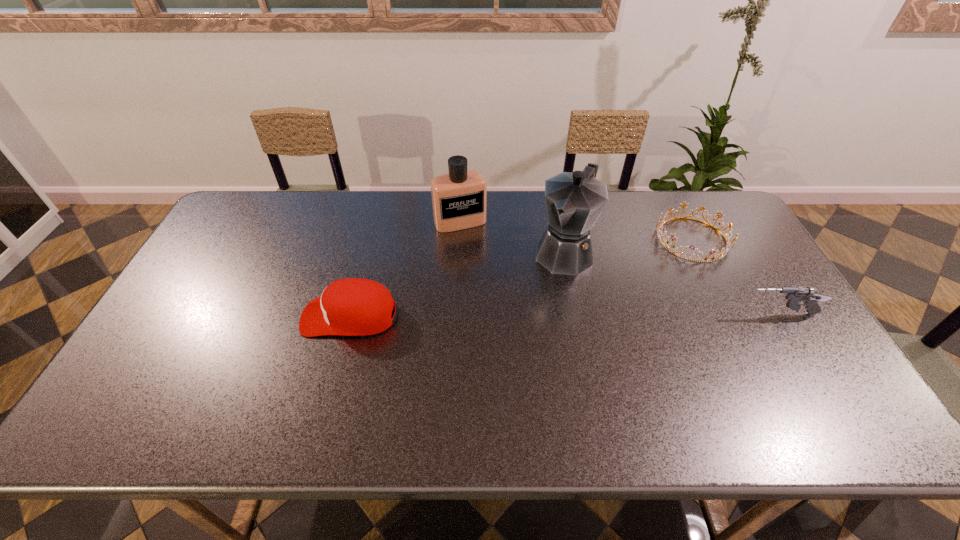
Locate an element on the screen. This screenshot has height=540, width=960. blank space at the left edge of the desktop is located at coordinates (228, 247).

In the image, there is a desktop. Where is `vacant space at the right edge`? vacant space at the right edge is located at coordinates (750, 278).

The height and width of the screenshot is (540, 960). In order to click on free space at the far right corner in this screenshot , I will do `click(707, 192)`.

Identify the location of free area in between the shortest object and the leftmost object. (521, 278).

Locate an element on the screen. This screenshot has width=960, height=540. vacant area that lies between the third object from left to right and the shortest object is located at coordinates (628, 245).

You are a GUI agent. You are given a task and a screenshot of the screen. Output one action in this format:
    pyautogui.click(x=<x>, y=<y>)
    Task: Click on the vacant point located between the tiara and the leftmost object
    This screenshot has height=540, width=960.
    Given the screenshot: What is the action you would take?
    [521, 278]

What are the coordinates of `vacant area between the leftmost object and the coffeepot` in the screenshot? It's located at (457, 284).

Image resolution: width=960 pixels, height=540 pixels. Find the location of `vacant point located between the leftmost object and the tallest object`. vacant point located between the leftmost object and the tallest object is located at coordinates (457, 284).

Where is `vacant space that's between the shortest object and the leftmost object`? The image size is (960, 540). vacant space that's between the shortest object and the leftmost object is located at coordinates (521, 278).

Image resolution: width=960 pixels, height=540 pixels. I want to click on free space between the shortest object and the gun, so click(735, 277).